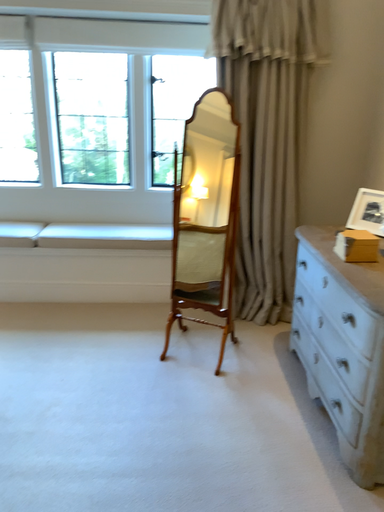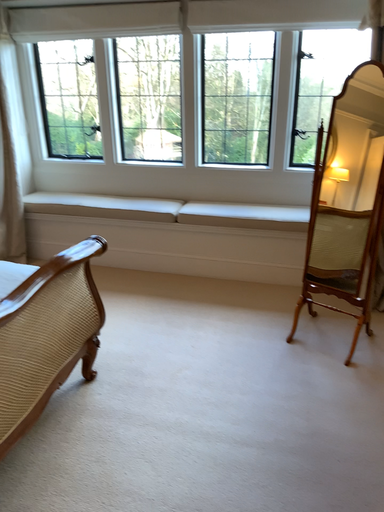
Question: How did the camera likely rotate when shooting the video?

Choices:
 (A) rotated left
 (B) rotated right

Answer: (A)